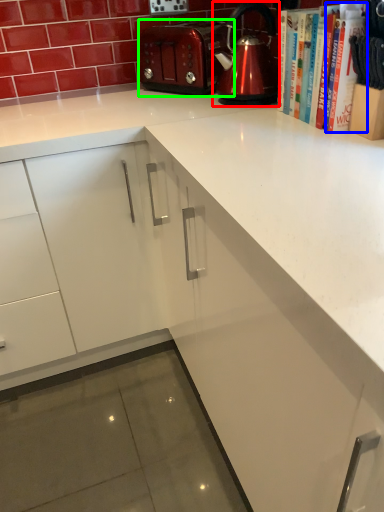
Question: Considering the real-world distances, which object is closest to kettle (highlighted by a red box)? book (highlighted by a blue box) or toaster (highlighted by a green box).

Choices:
 (A) book
 (B) toaster

Answer: (B)